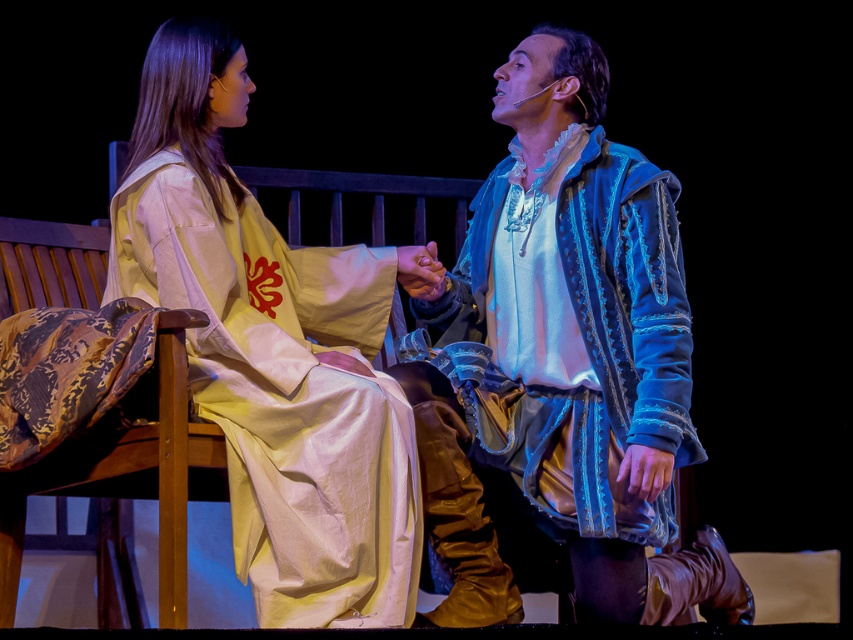
Measure the distance between blue suede jacket at center and silk robe at left.

They are 14.88 inches apart.

Which of these two, blue suede jacket at center or silk robe at left, stands shorter?

With less height is silk robe at left.

Who is more distant from viewer, (461, 387) or (196, 292)?

The point (461, 387) is more distant.

The image size is (853, 640). What are the coordinates of `blue suede jacket at center` in the screenshot? It's located at (569, 360).